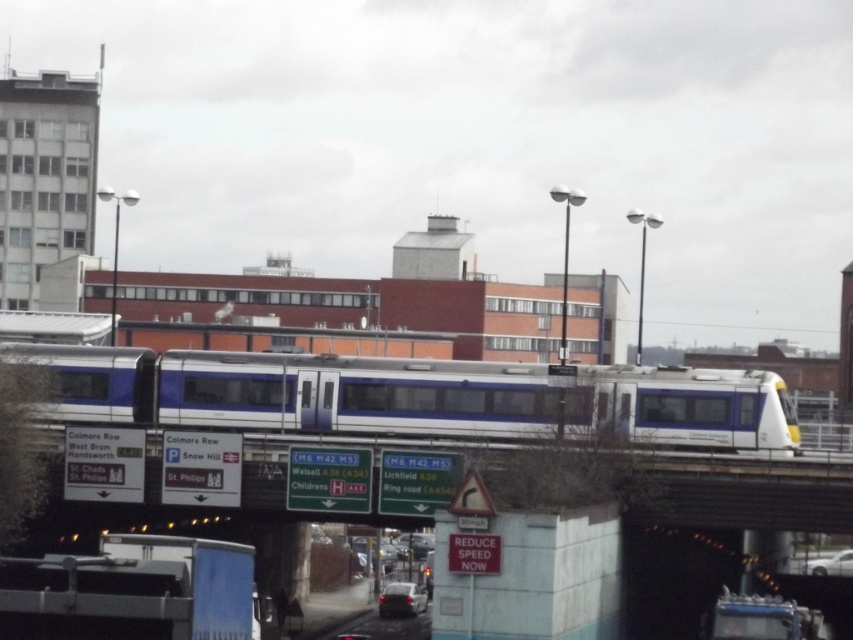
Question: Which object appears farthest from the camera in this image?

Choices:
 (A) metallic silver car at center
 (B) white plastic signboard at upper center

Answer: (A)

Question: Is white glossy train at center to the right of white plastic signboard at upper center from the viewer's perspective?

Choices:
 (A) yes
 (B) no

Answer: (B)

Question: Which object appears closest to the camera in this image?

Choices:
 (A) silver metallic sedan at center
 (B) white plastic signboard at upper center

Answer: (B)

Question: Which point appears farthest from the camera in this image?

Choices:
 (A) (283, 508)
 (B) (402, 609)

Answer: (B)

Question: Is silver metallic sedan at center thinner than metallic silver car at center?

Choices:
 (A) no
 (B) yes

Answer: (B)

Question: Can you confirm if white plastic signboard at upper center is bigger than white glossy car at lower right?

Choices:
 (A) yes
 (B) no

Answer: (A)